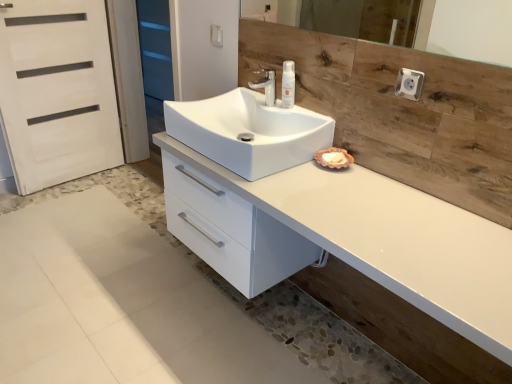
Question: Is white plastic socket at upper right positioned behind matte silver faucet at center?

Choices:
 (A) no
 (B) yes

Answer: (A)

Question: Would you say matte silver faucet at center is part of white plastic socket at upper right's contents?

Choices:
 (A) yes
 (B) no

Answer: (B)

Question: Is white plastic socket at upper right touching matte silver faucet at center?

Choices:
 (A) no
 (B) yes

Answer: (A)

Question: Can you confirm if white plastic socket at upper right is positioned to the left of matte silver faucet at center?

Choices:
 (A) no
 (B) yes

Answer: (A)

Question: Is white plastic socket at upper right taller than matte silver faucet at center?

Choices:
 (A) no
 (B) yes

Answer: (A)

Question: Can you confirm if white plastic socket at upper right is thinner than matte silver faucet at center?

Choices:
 (A) no
 (B) yes

Answer: (B)

Question: Is white plastic bottle at upper center positioned beyond the bounds of matte silver faucet at center?

Choices:
 (A) yes
 (B) no

Answer: (A)

Question: Does white plastic bottle at upper center have a smaller size compared to matte silver faucet at center?

Choices:
 (A) no
 (B) yes

Answer: (B)

Question: Is white plastic bottle at upper center turned away from matte silver faucet at center?

Choices:
 (A) yes
 (B) no

Answer: (B)

Question: From a real-world perspective, is white plastic bottle at upper center physically above matte silver faucet at center?

Choices:
 (A) no
 (B) yes

Answer: (B)

Question: From the image's perspective, does white plastic bottle at upper center appear lower than matte silver faucet at center?

Choices:
 (A) no
 (B) yes

Answer: (B)

Question: Does white plastic bottle at upper center have a greater height compared to matte silver faucet at center?

Choices:
 (A) no
 (B) yes

Answer: (B)

Question: Is white glossy cabinet at center at the back of wooden mirror at upper center?

Choices:
 (A) no
 (B) yes

Answer: (A)